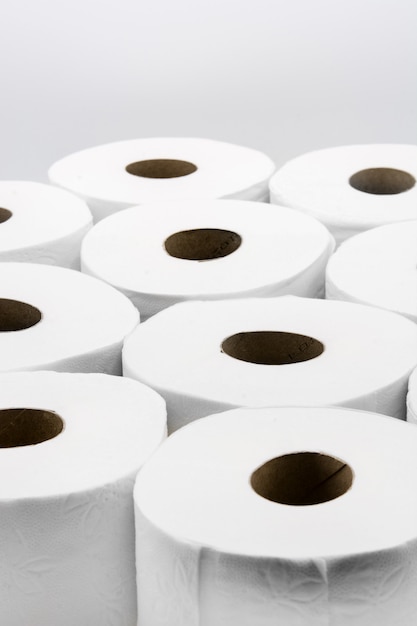
At what (x,y) coordinates should I click in order to perform the action: click on toilet paper roll. Please return your answer as a coordinate pair (x, y). This screenshot has height=626, width=417. Looking at the image, I should click on (94, 486), (193, 511), (98, 324), (196, 262), (406, 260), (392, 207), (413, 393), (216, 177), (61, 222).